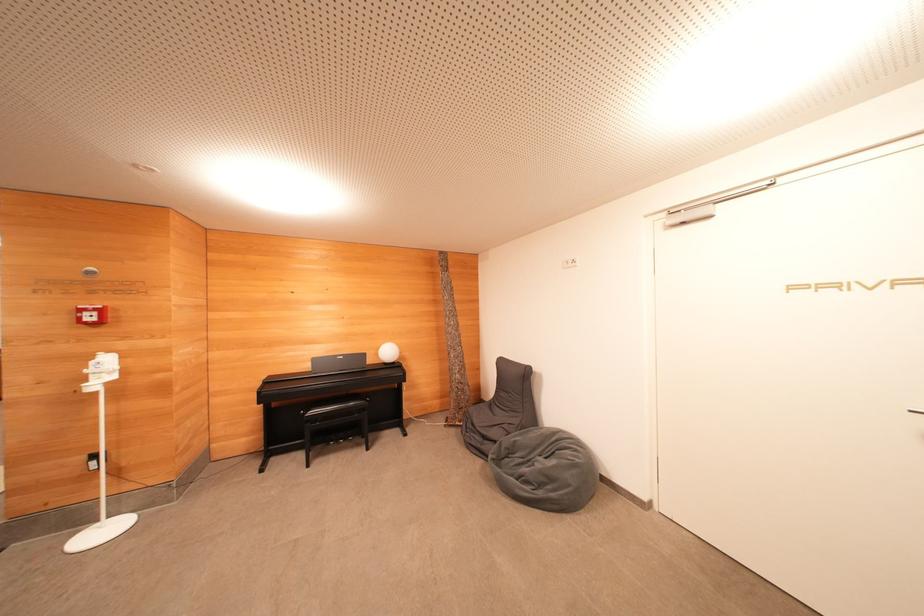
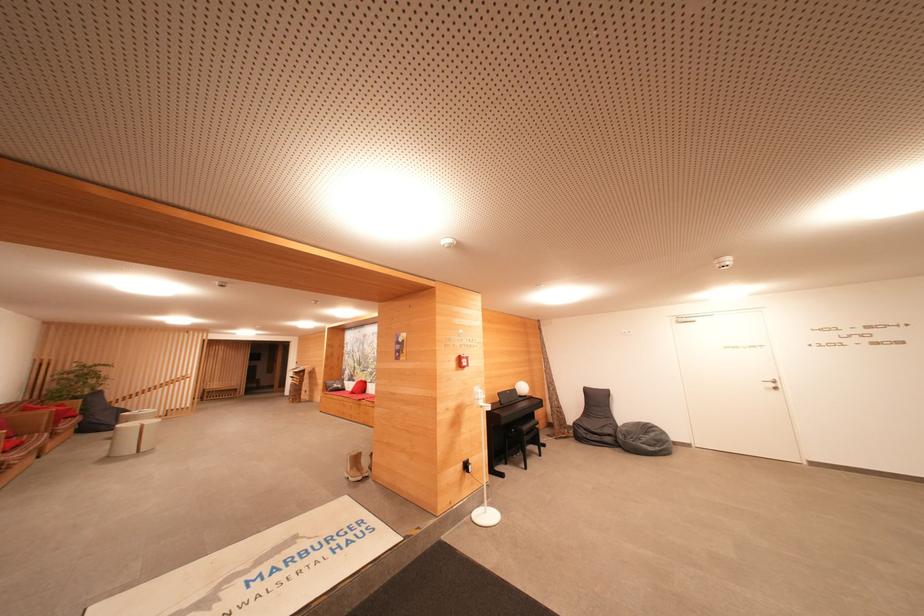
Locate, in the second image, the point that corresponds to pixel 556 466 in the first image.

(655, 438)